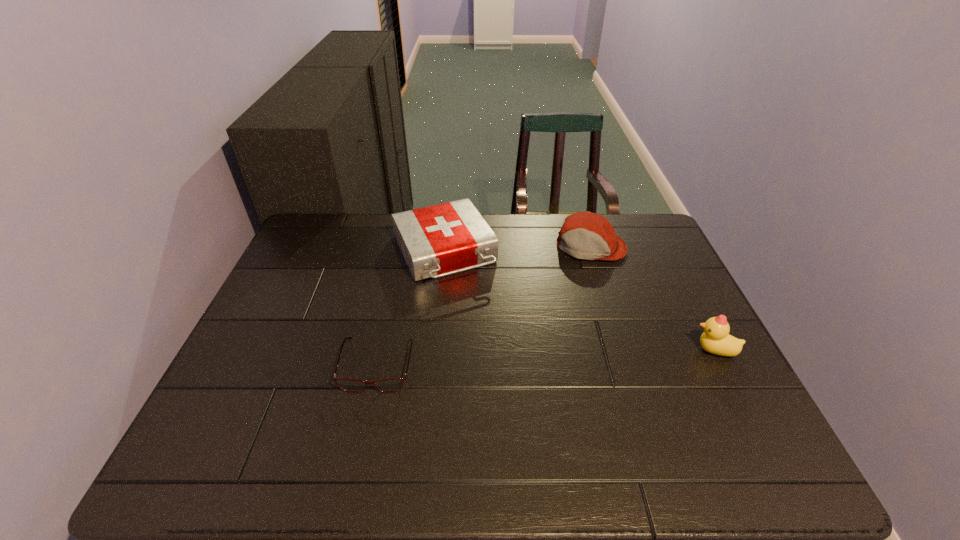
Where is `vacant area at the left edge of the desktop`? This screenshot has width=960, height=540. vacant area at the left edge of the desktop is located at coordinates (252, 372).

Image resolution: width=960 pixels, height=540 pixels. What are the coordinates of `vacant area at the right edge` in the screenshot? It's located at (664, 316).

The width and height of the screenshot is (960, 540). In the image, there is a desktop. What are the coordinates of `vacant space at the near left corner` in the screenshot? It's located at (279, 411).

Where is `vacant space that's between the spectacles and the third object from left to right`? The height and width of the screenshot is (540, 960). vacant space that's between the spectacles and the third object from left to right is located at coordinates (484, 306).

You are a GUI agent. You are given a task and a screenshot of the screen. Output one action in this format:
    pyautogui.click(x=<x>, y=<y>)
    Task: Click on the vacant area that lies between the rightmost object and the first-aid kit
    Image resolution: width=960 pixels, height=540 pixels.
    Given the screenshot: What is the action you would take?
    pyautogui.click(x=579, y=302)

In order to click on free spot between the second object from right to left and the shortest object in this screenshot , I will do `click(484, 306)`.

At what (x,y) coordinates should I click in order to perform the action: click on free space between the duckling and the cap. Please return your answer as a coordinate pair (x, y). Looking at the image, I should click on (653, 299).

You are a GUI agent. You are given a task and a screenshot of the screen. Output one action in this format:
    pyautogui.click(x=<x>, y=<y>)
    Task: Click on the vacant space in between the duckling and the cap
    This screenshot has height=540, width=960.
    Given the screenshot: What is the action you would take?
    pyautogui.click(x=653, y=299)

Identify the location of free area in between the duckling and the spectacles. (546, 357).

At what (x,y) coordinates should I click in order to perform the action: click on unoccupied position between the first-aid kit and the shortest object. Please return your answer as a coordinate pair (x, y). The image size is (960, 540). Looking at the image, I should click on (411, 309).